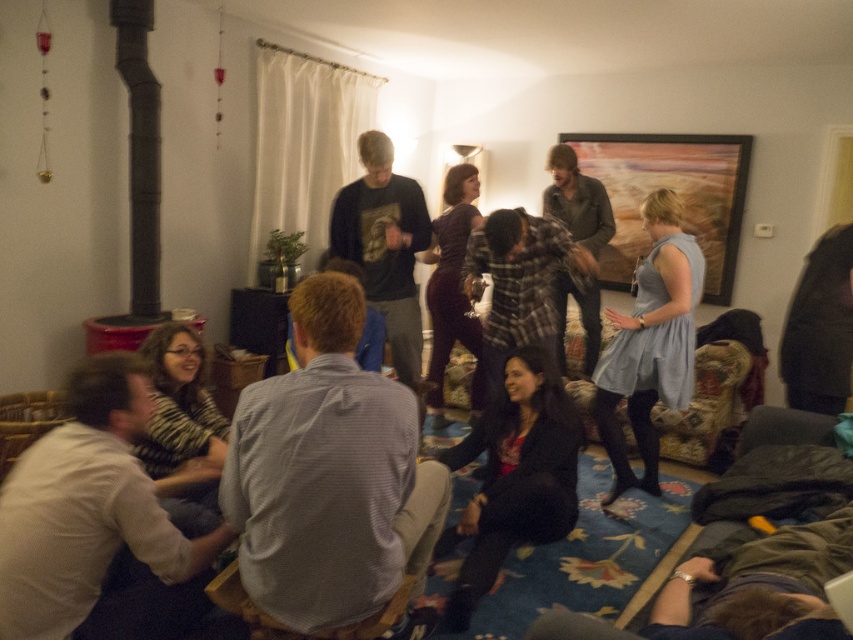
Who is shorter, black velvet dress at center or light blue fabric dress at center?

black velvet dress at center

Is point (482, 413) closer to viewer compared to point (668, 237)?

No, it is not.

Identify the location of black velvet dress at center. (514, 476).

Who is lower down, black velvet dress at center or black matte pipe at left?

black velvet dress at center is below.

Between point (492, 417) and point (140, 36), which one is positioned behind?

Point (140, 36)

At what (x,y) coordinates should I click in order to perform the action: click on black velvet dress at center. Please return your answer as a coordinate pair (x, y). Looking at the image, I should click on (514, 476).

Can you confirm if light blue fabric dress at center is positioned to the left of black matte pipe at left?

In fact, light blue fabric dress at center is to the right of black matte pipe at left.

Does light blue fabric dress at center appear under black matte pipe at left?

Correct, light blue fabric dress at center is located below black matte pipe at left.

Between point (656, 477) and point (144, 262), which one is positioned in front?

Point (656, 477) is in front.

Identify the location of light blue fabric dress at center. (650, 344).